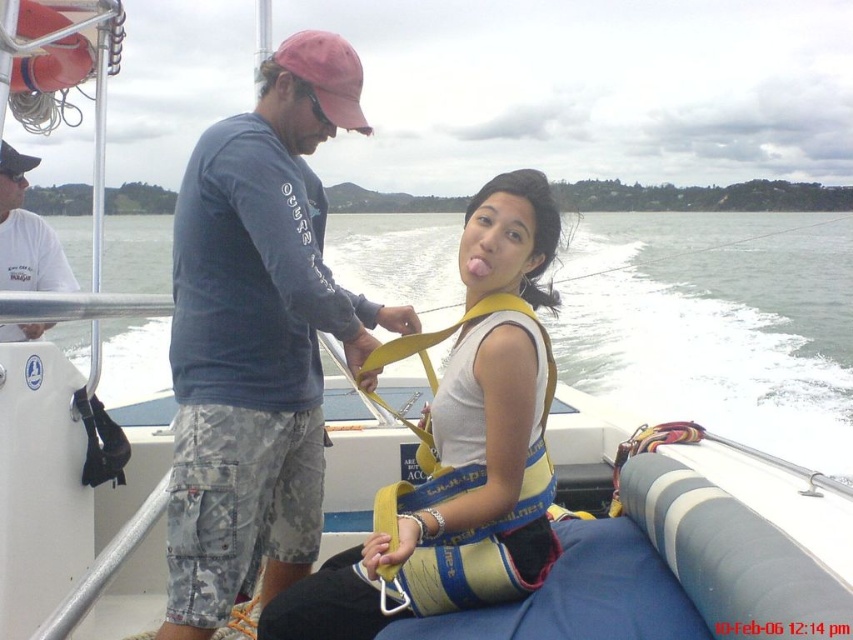
You are a photographer on the boat and want to take a photo of the yellow life vest at center and the white cotton shirt at upper left. Which object should you focus on first if you want to capture both in the frame without moving the camera?

The yellow life vest at center is much taller than the white cotton shirt at upper left, so you should focus on the yellow life vest at center first to ensure it fits within the frame.

You are a photographer on the boat and want to capture both the yellow life vest at center and the white cotton shirt at upper left in the same frame. Which object should you position closer to the left side of your camera viewfinder to include both?

To include both the yellow life vest at center and the white cotton shirt at upper left in the same frame, position the white cotton shirt at upper left closer to the left side of your camera viewfinder since the yellow life vest at center is already to the right of it.